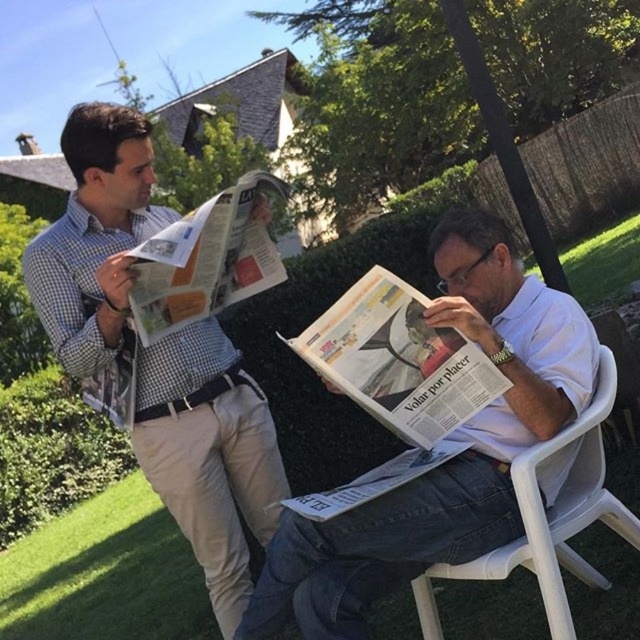
Does point (355, 362) come farther from viewer compared to point (172, 291)?

No, (355, 362) is closer to viewer.

Between white glossy newspaper at center and matte newspaper at upper left, which one has less height?

matte newspaper at upper left

Describe the element at coordinates (397, 358) in the screenshot. I see `white glossy newspaper at center` at that location.

Locate an element on the screen. white glossy newspaper at center is located at coordinates (397, 358).

Does white plastic folding chair at lower right appear on the left side of matte newspaper at upper left?

Incorrect, white plastic folding chair at lower right is not on the left side of matte newspaper at upper left.

Which of these two, white plastic folding chair at lower right or matte newspaper at upper left, stands taller?

white plastic folding chair at lower right is taller.

At what (x,y) coordinates should I click in order to perform the action: click on white plastic folding chair at lower right. Please return your answer as a coordinate pair (x, y). The height and width of the screenshot is (640, 640). Looking at the image, I should click on (548, 518).

Locate an element on the screen. white plastic folding chair at lower right is located at coordinates (548, 518).

Does checkered fabric shirt at left have a smaller size compared to white plastic folding chair at lower right?

No, checkered fabric shirt at left is not smaller than white plastic folding chair at lower right.

Is checkered fabric shirt at left taller than white plastic folding chair at lower right?

Yes.

The height and width of the screenshot is (640, 640). What do you see at coordinates (209, 454) in the screenshot?
I see `checkered fabric shirt at left` at bounding box center [209, 454].

At what (x,y) coordinates should I click in order to perform the action: click on checkered fabric shirt at left. Please return your answer as a coordinate pair (x, y). This screenshot has height=640, width=640. Looking at the image, I should click on pos(209,454).